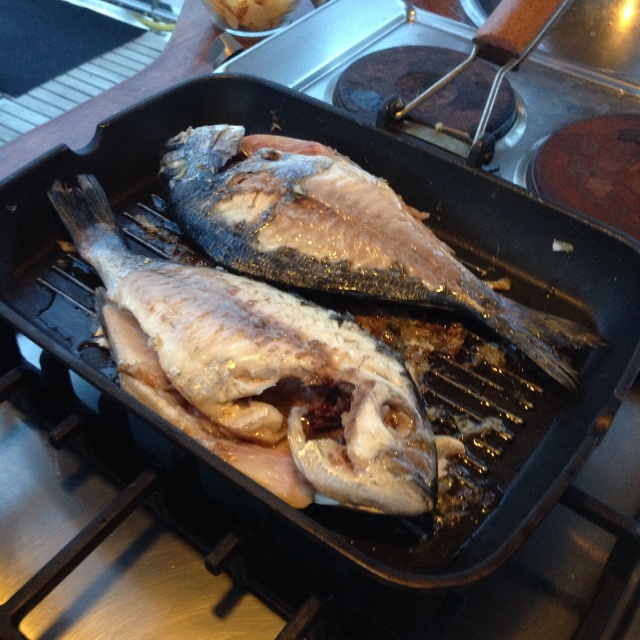
Between shiny silver fish at center and glistening silver fish at center, which one is positioned higher?

Positioned higher is glistening silver fish at center.

Which is behind, point (388, 493) or point (227, 198)?

The point (227, 198) is more distant.

Where is `shiny silver fish at center`? The width and height of the screenshot is (640, 640). shiny silver fish at center is located at coordinates (259, 372).